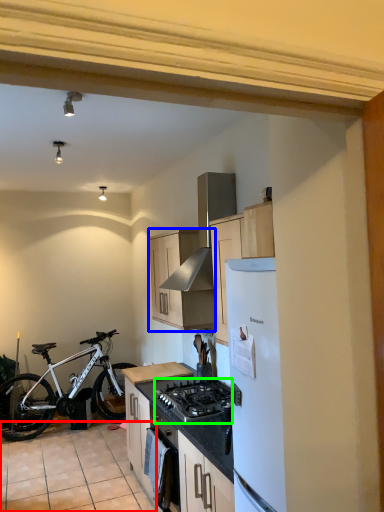
Question: Which is farther away from tile (highlighted by a red box)? cabinetry (highlighted by a blue box) or gas stove (highlighted by a green box)?

Choices:
 (A) cabinetry
 (B) gas stove

Answer: (A)